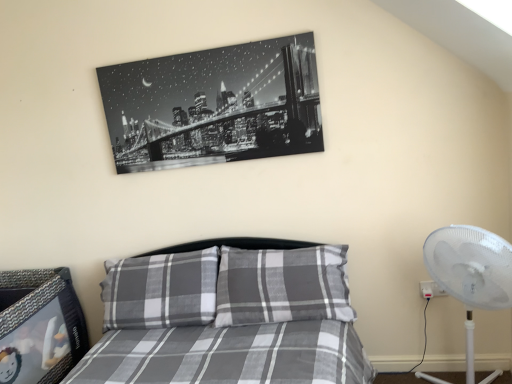
Question: Is white plastic fan at right wider than gray plaid bed at center?

Choices:
 (A) yes
 (B) no

Answer: (B)

Question: From the image's perspective, is white plastic fan at right below gray plaid bed at center?

Choices:
 (A) no
 (B) yes

Answer: (A)

Question: Is white plastic fan at right shorter than gray plaid bed at center?

Choices:
 (A) no
 (B) yes

Answer: (A)

Question: Is white plastic fan at right oriented away from gray plaid bed at center?

Choices:
 (A) no
 (B) yes

Answer: (A)

Question: Is white plastic fan at right positioned before gray plaid bed at center?

Choices:
 (A) no
 (B) yes

Answer: (A)

Question: Is white plastic fan at right facing towards gray plaid bed at center?

Choices:
 (A) no
 (B) yes

Answer: (A)

Question: Is black glossy print at upper center surrounding white plastic fan at right?

Choices:
 (A) yes
 (B) no

Answer: (B)

Question: Is black glossy print at upper center next to white plastic fan at right and touching it?

Choices:
 (A) yes
 (B) no

Answer: (B)

Question: Does black glossy print at upper center appear on the right side of white plastic fan at right?

Choices:
 (A) no
 (B) yes

Answer: (A)

Question: From a real-world perspective, is black glossy print at upper center physically below white plastic fan at right?

Choices:
 (A) yes
 (B) no

Answer: (B)

Question: From the image's perspective, does black glossy print at upper center appear higher than white plastic fan at right?

Choices:
 (A) no
 (B) yes

Answer: (B)

Question: Is black glossy print at upper center taller than white plastic fan at right?

Choices:
 (A) yes
 (B) no

Answer: (B)

Question: Can you confirm if gray plaid bed at center is smaller than white plastic fan at right?

Choices:
 (A) yes
 (B) no

Answer: (B)